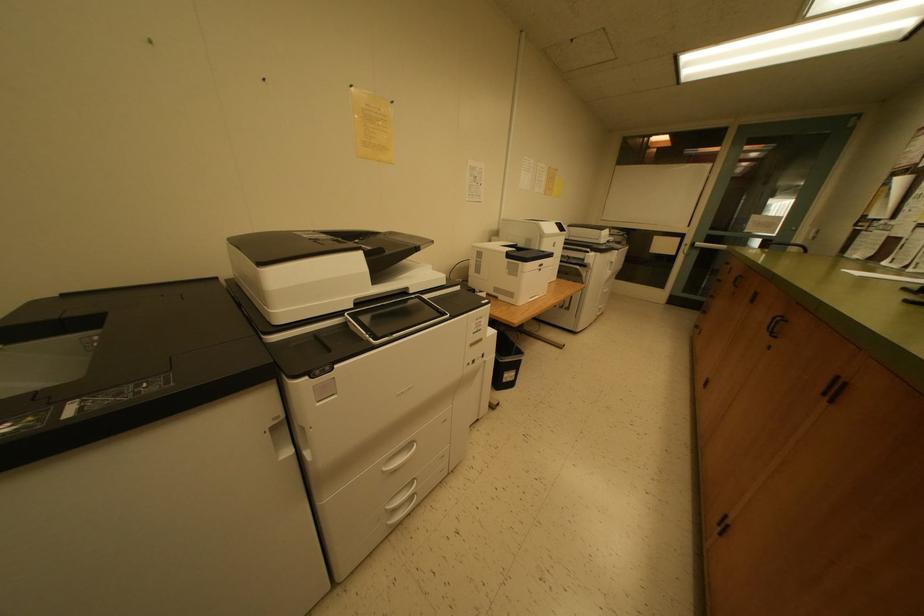
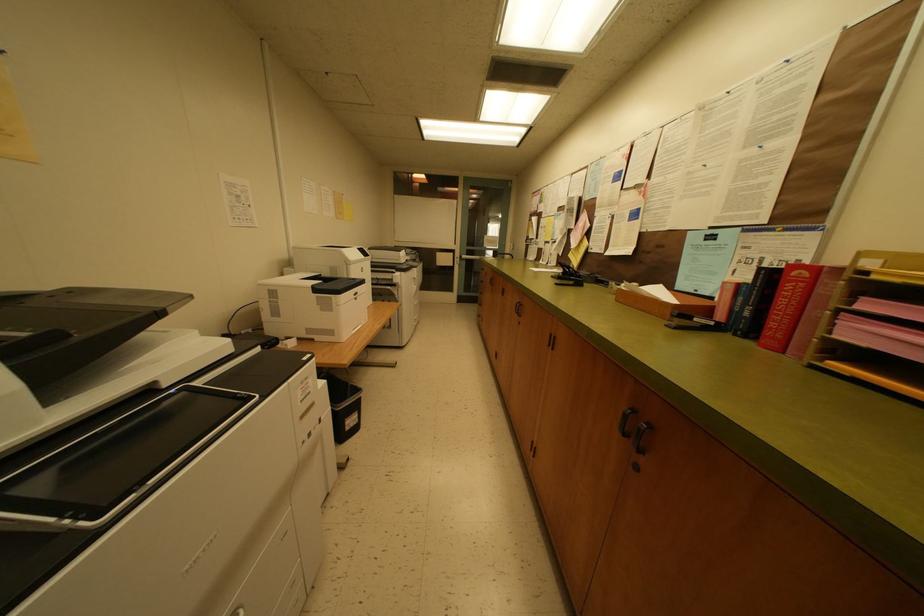
Question: The camera is either moving clockwise (left) or counter-clockwise (right) around the object. The first image is from the beginning of the video and the second image is from the end. Is the camera moving left or right when shooting the video?

Choices:
 (A) Left
 (B) Right

Answer: (A)